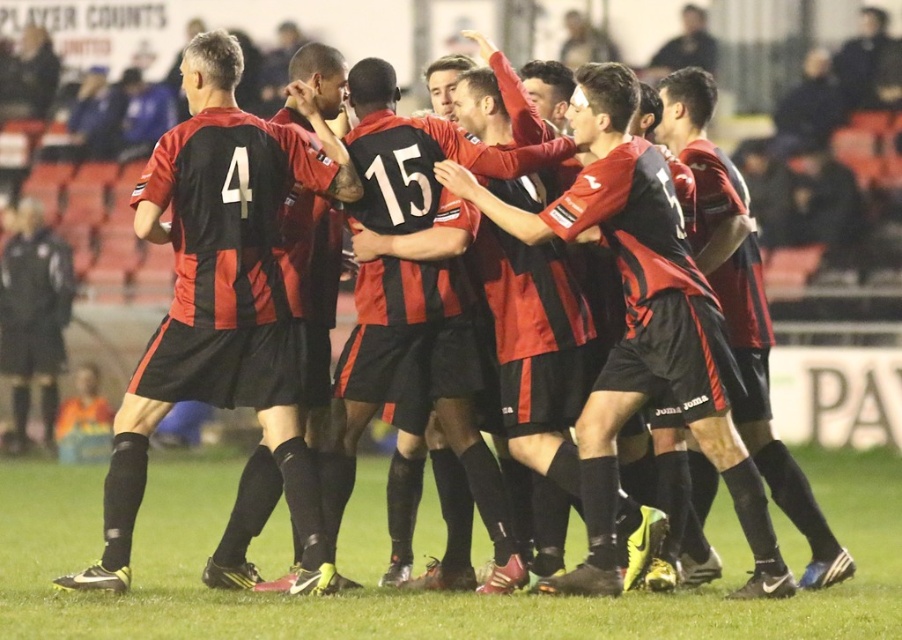
Can you confirm if green grass at center is positioned above matte jersey at left?

Incorrect, green grass at center is not positioned above matte jersey at left.

Between point (72, 604) and point (273, 186), which one is positioned behind?

Point (273, 186)

Who is more forward, (831, 470) or (226, 307)?

Point (226, 307)

Find the location of a particular element. Image resolution: width=902 pixels, height=640 pixels. green grass at center is located at coordinates (405, 589).